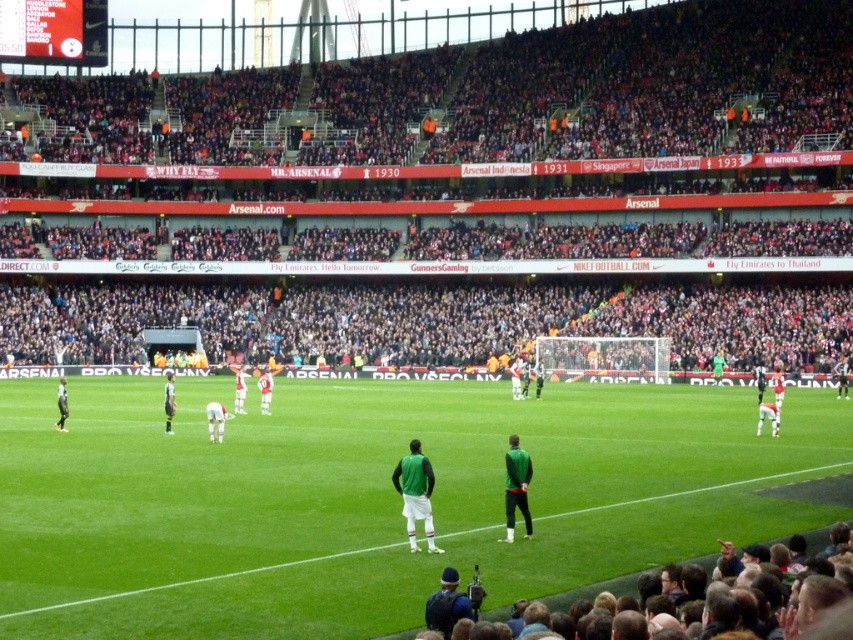
Question: Can you confirm if green grass field at center is positioned above green matte jacket at center?

Choices:
 (A) no
 (B) yes

Answer: (A)

Question: Which point is farther from the camera taking this photo?

Choices:
 (A) (279, 598)
 (B) (222, 406)

Answer: (B)

Question: Does green grass field at center have a larger size compared to white matte soccer player at center?

Choices:
 (A) yes
 (B) no

Answer: (A)

Question: Which point is farther to the camera?

Choices:
 (A) white matte soccer player at center
 (B) green matte jersey at center
 (C) green grass field at center

Answer: (A)

Question: Is green matte jacket at center below white matte soccer player at center?

Choices:
 (A) yes
 (B) no

Answer: (A)

Question: Which point is closer to the camera?

Choices:
 (A) pos(511,483)
 (B) pos(421,488)
 (C) pos(321,572)

Answer: (C)